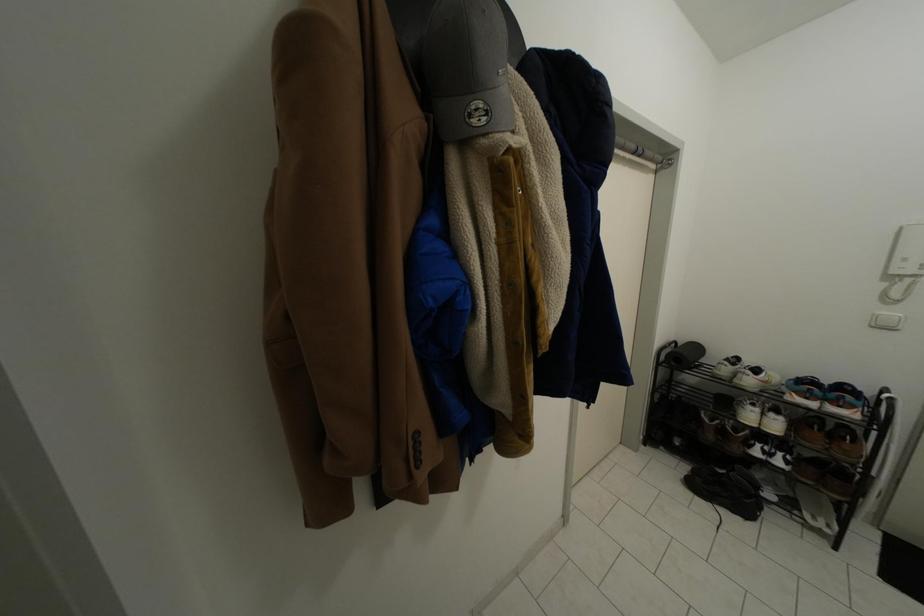
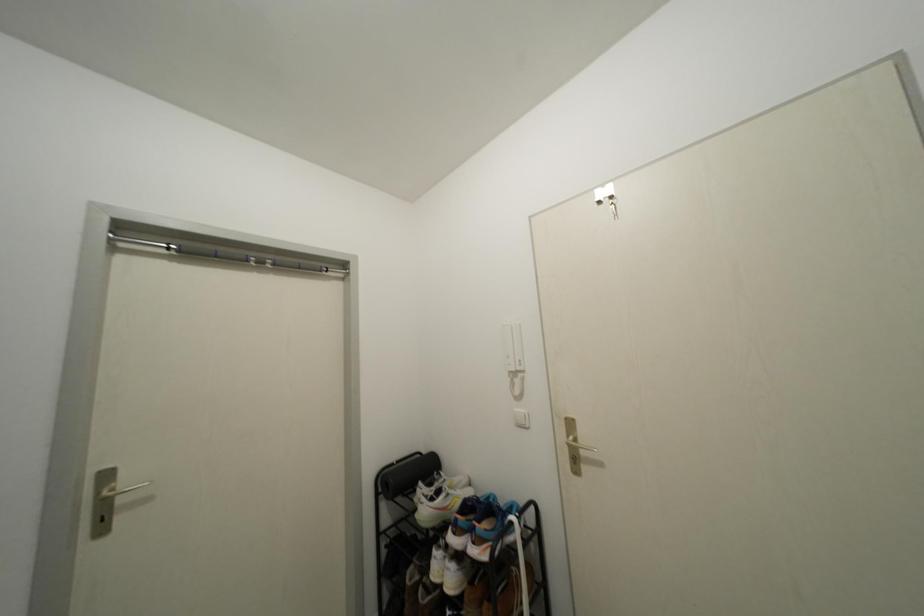
Question: What movement of the cameraman would produce the second image?

Choices:
 (A) Left
 (B) Right
 (C) Forward
 (D) Backward

Answer: (B)